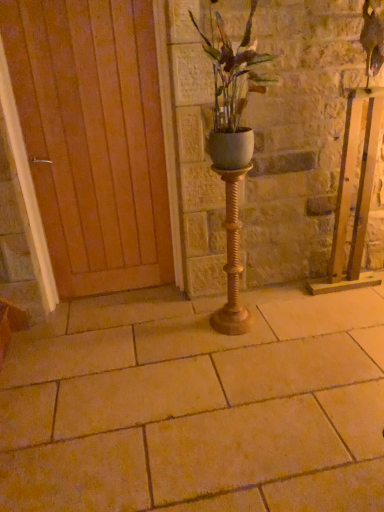
Question: Is gold textured candle holder at center positioned in front of white matte pot at center?

Choices:
 (A) no
 (B) yes

Answer: (A)

Question: Does gold textured candle holder at center turn towards white matte pot at center?

Choices:
 (A) no
 (B) yes

Answer: (A)

Question: Would you say white matte pot at center is part of gold textured candle holder at center's contents?

Choices:
 (A) yes
 (B) no

Answer: (B)

Question: From a real-world perspective, is gold textured candle holder at center on white matte pot at center?

Choices:
 (A) no
 (B) yes

Answer: (A)

Question: From the image's perspective, is gold textured candle holder at center beneath white matte pot at center?

Choices:
 (A) yes
 (B) no

Answer: (A)

Question: Is wooden at left bigger or smaller than beige stone pavement at center?

Choices:
 (A) small
 (B) big

Answer: (A)

Question: From a real-world perspective, is wooden at left physically located above or below beige stone pavement at center?

Choices:
 (A) above
 (B) below

Answer: (A)

Question: Do you think wooden at left is within beige stone pavement at center, or outside of it?

Choices:
 (A) inside
 (B) outside

Answer: (B)

Question: In the image, is wooden at left on the left side or the right side of beige stone pavement at center?

Choices:
 (A) right
 (B) left

Answer: (B)

Question: From the image's perspective, relative to wooden at left, is gold textured candle holder at center above or below?

Choices:
 (A) above
 (B) below

Answer: (B)

Question: In the image, is gold textured candle holder at center on the left side or the right side of wooden at left?

Choices:
 (A) right
 (B) left

Answer: (A)

Question: Considering the positions of point (236, 201) and point (160, 181), is point (236, 201) closer or farther from the camera than point (160, 181)?

Choices:
 (A) closer
 (B) farther

Answer: (A)

Question: Is gold textured candle holder at center inside the boundaries of wooden at left, or outside?

Choices:
 (A) outside
 (B) inside

Answer: (A)

Question: From the image's perspective, is wooden at left above or below white matte pot at center?

Choices:
 (A) below
 (B) above

Answer: (A)

Question: From a real-world perspective, relative to white matte pot at center, is wooden at left vertically above or below?

Choices:
 (A) below
 (B) above

Answer: (A)